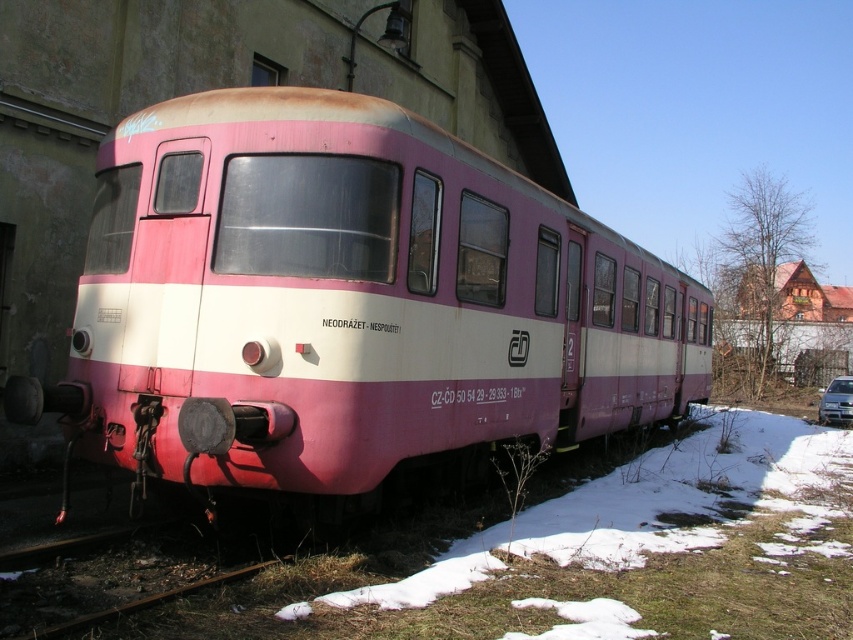
Which is above, pink matte train at center or metallic silver car at lower right?

pink matte train at center is higher up.

Is pink matte train at center taller than metallic silver car at lower right?

Correct, pink matte train at center is much taller as metallic silver car at lower right.

Which is in front, point (480, 433) or point (834, 394)?

Positioned in front is point (480, 433).

You are a GUI agent. You are given a task and a screenshot of the screen. Output one action in this format:
    pyautogui.click(x=<x>, y=<y>)
    Task: Click on the pink matte train at center
    This screenshot has width=853, height=640.
    Given the screenshot: What is the action you would take?
    pyautogui.click(x=351, y=300)